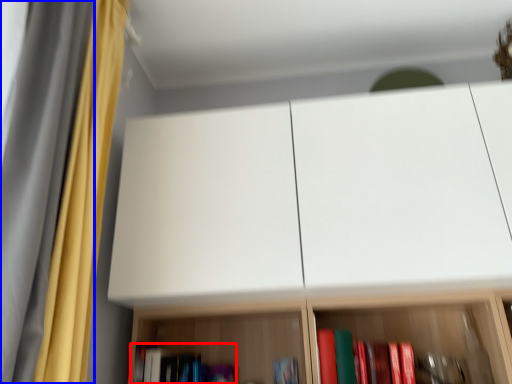
Question: Among these objects, which one is farthest to the camera, book (highlighted by a red box) or curtain (highlighted by a blue box)?

Choices:
 (A) book
 (B) curtain

Answer: (A)